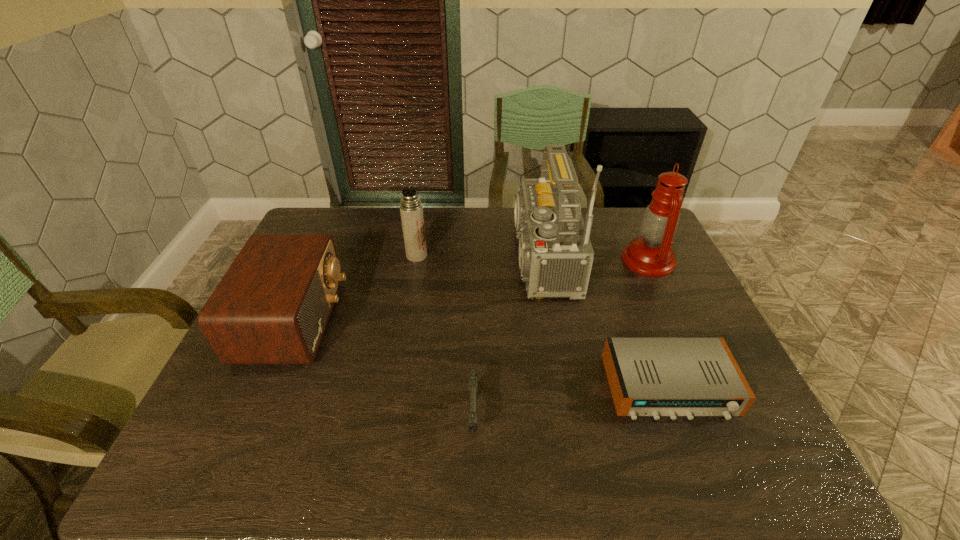
The height and width of the screenshot is (540, 960). In order to click on oil lamp situated at the far edge in this screenshot , I will do `click(651, 254)`.

The width and height of the screenshot is (960, 540). In order to click on object that is at the near edge in this screenshot , I will do `click(473, 376)`.

This screenshot has height=540, width=960. What are the coordinates of `object located in the left edge section of the desktop` in the screenshot? It's located at point(272,306).

This screenshot has width=960, height=540. What are the coordinates of `oil lamp positioned at the right edge` in the screenshot? It's located at (651, 254).

Find the location of `radio receiver present at the right edge`. radio receiver present at the right edge is located at coordinates (656, 377).

Locate an element on the screen. The image size is (960, 540). object at the far right corner is located at coordinates (651, 254).

At what (x,y) coordinates should I click in order to perform the action: click on vacant point at the far edge. Please return your answer as a coordinate pair (x, y). Looking at the image, I should click on (372, 238).

In the image, there is a desktop. Where is `blank space at the near edge`? The image size is (960, 540). blank space at the near edge is located at coordinates (541, 440).

In the image, there is a desktop. At what (x,y) coordinates should I click in order to perform the action: click on free space at the left edge. Please return your answer as a coordinate pair (x, y). The width and height of the screenshot is (960, 540). Looking at the image, I should click on (228, 378).

Image resolution: width=960 pixels, height=540 pixels. What are the coordinates of `vacant space at the right edge of the desktop` in the screenshot? It's located at pos(730,428).